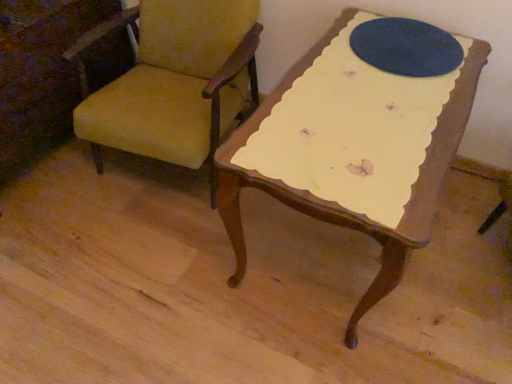
Question: Considering the positions of blue felt oval at upper center and yellow fabric chair at upper left in the image, is blue felt oval at upper center wider or thinner than yellow fabric chair at upper left?

Choices:
 (A) wide
 (B) thin

Answer: (B)

Question: From the image's perspective, is blue felt oval at upper center above or below yellow fabric chair at upper left?

Choices:
 (A) below
 (B) above

Answer: (B)

Question: Considering the relative positions of blue felt oval at upper center and yellow fabric chair at upper left in the image provided, is blue felt oval at upper center to the left or to the right of yellow fabric chair at upper left?

Choices:
 (A) right
 (B) left

Answer: (A)

Question: In terms of height, does yellow fabric chair at upper left look taller or shorter compared to blue felt oval at upper center?

Choices:
 (A) short
 (B) tall

Answer: (B)

Question: In terms of width, does yellow fabric chair at upper left look wider or thinner when compared to blue felt oval at upper center?

Choices:
 (A) thin
 (B) wide

Answer: (B)

Question: Does point (158, 51) appear closer or farther from the camera than point (407, 72)?

Choices:
 (A) farther
 (B) closer

Answer: (A)

Question: From a real-world perspective, relative to blue felt oval at upper center, is yellow fabric chair at upper left vertically above or below?

Choices:
 (A) below
 (B) above

Answer: (A)